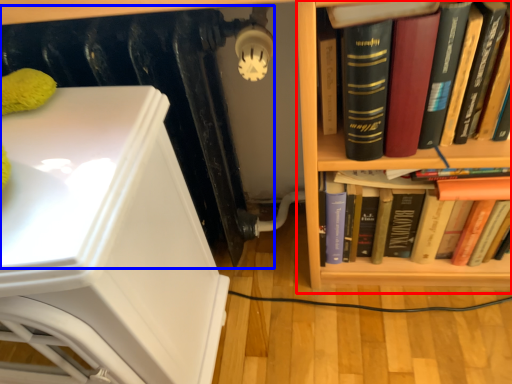
Question: Which point is closer to the camera, bookcase (highlighted by a red box) or radiator (highlighted by a blue box)?

Choices:
 (A) bookcase
 (B) radiator

Answer: (A)